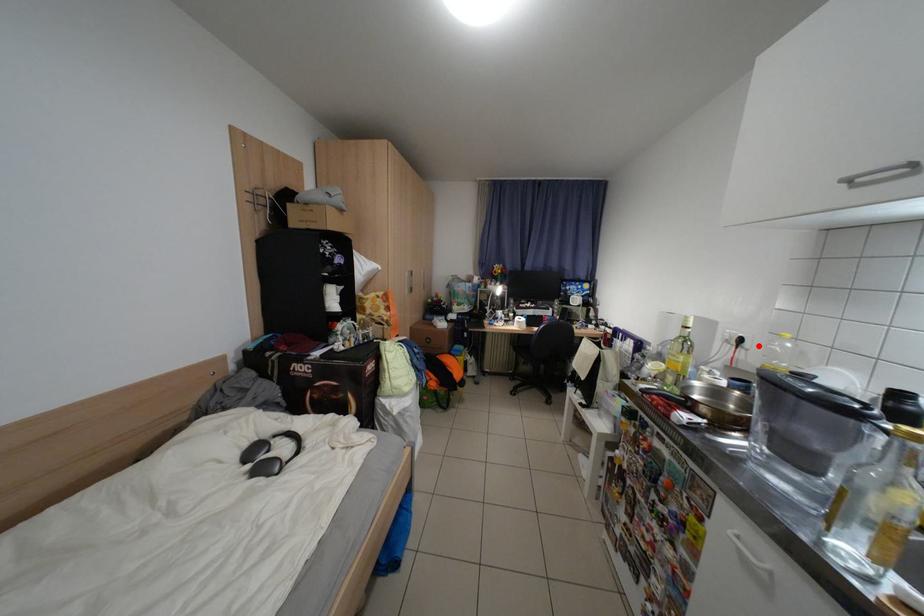
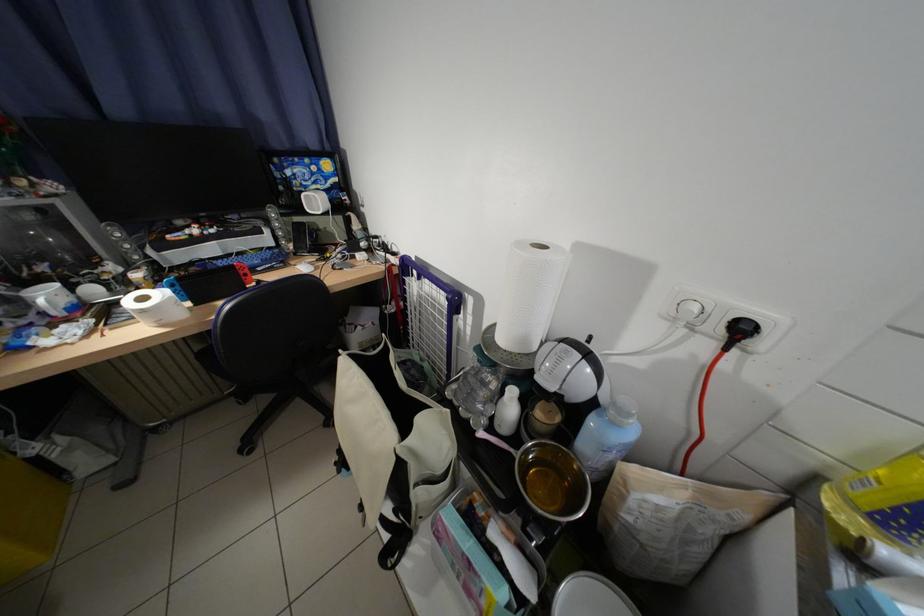
The point at the highlighted location is marked in the first image. Where is the corresponding point in the second image?

(772, 345)